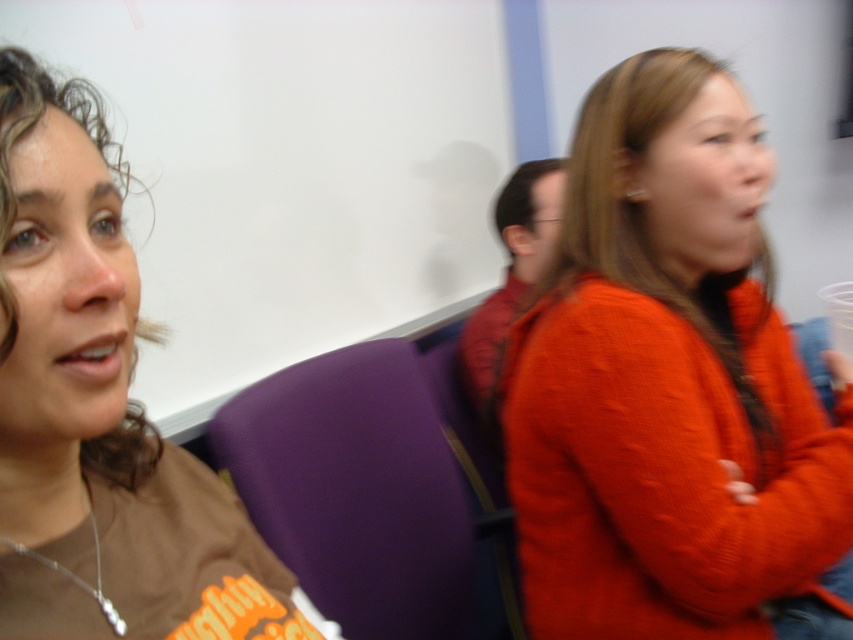
Question: From the image, what is the correct spatial relationship of orange knitted sweater at right in relation to brown cotton shirt at left?

Choices:
 (A) right
 (B) left

Answer: (A)

Question: Considering the real-world distances, which object is closest to the orange knitted sweater at right?

Choices:
 (A) brown cotton shirt at left
 (B) purple fabric chair at center

Answer: (B)

Question: Which point is closer to the camera?

Choices:
 (A) (846, 496)
 (B) (463, 614)

Answer: (A)

Question: Based on their relative distances, which object is farther from the purple fabric chair at center?

Choices:
 (A) orange knitted sweater at right
 (B) brown cotton shirt at left

Answer: (B)

Question: Is orange knitted sweater at right thinner than purple fabric chair at center?

Choices:
 (A) no
 (B) yes

Answer: (A)

Question: In this image, where is orange knitted sweater at right located relative to purple fabric chair at center?

Choices:
 (A) below
 (B) above

Answer: (B)